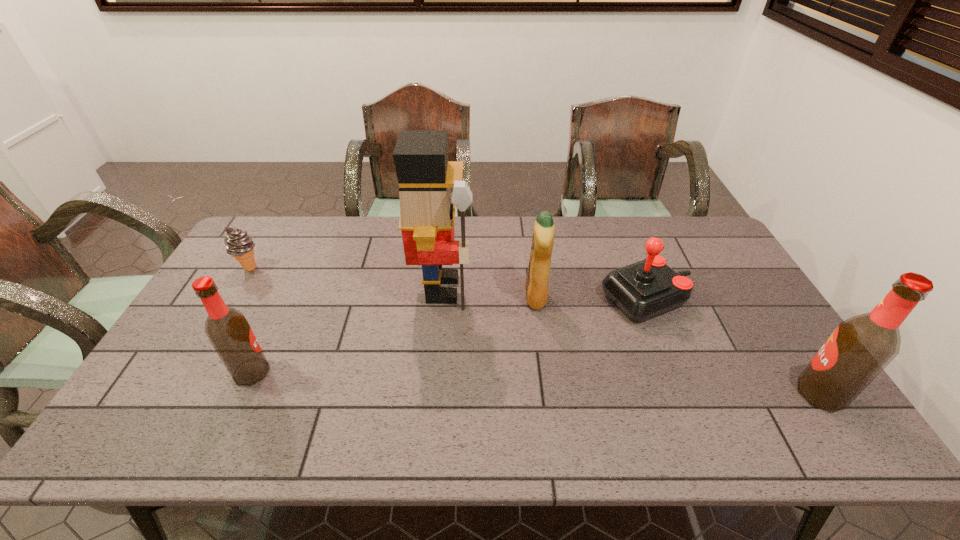
Where is `detergent`? The width and height of the screenshot is (960, 540). detergent is located at coordinates (538, 271).

At what (x,y) coordinates should I click in order to perform the action: click on free space located on the back of the second object from left to right. Please return your answer as a coordinate pair (x, y). Looking at the image, I should click on (265, 344).

Identify the location of vacant region located on the back of the right beer bottle. (758, 300).

Image resolution: width=960 pixels, height=540 pixels. Find the location of `free space located in front of the tallest object holding the staff`. free space located in front of the tallest object holding the staff is located at coordinates (598, 289).

At what (x,y) coordinates should I click in order to perform the action: click on vacant space located on the left of the fifth object from left to right. Please return your answer as a coordinate pair (x, y). This screenshot has height=540, width=960. Looking at the image, I should click on (481, 299).

You are a GUI agent. You are given a task and a screenshot of the screen. Output one action in this format:
    pyautogui.click(x=<x>, y=<y>)
    Task: Click on the vacant region located 0.350m on the right of the leftmost object
    
    Given the screenshot: What is the action you would take?
    pyautogui.click(x=371, y=268)

This screenshot has height=540, width=960. Identify the location of free space located on the label of the fourth object from left to right. (471, 297).

Identify the location of vacant space located on the label of the fourth object from left to right. The height and width of the screenshot is (540, 960). (412, 297).

I want to click on vacant space situated 0.080m on the label of the fourth object from left to right, so click(498, 297).

Identify the location of object present at the left edge. Image resolution: width=960 pixels, height=540 pixels. (239, 244).